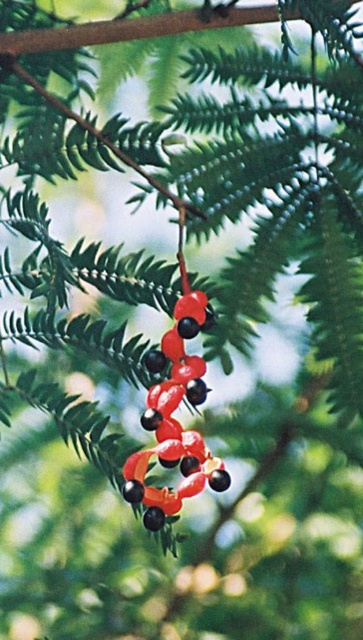
Image resolution: width=363 pixels, height=640 pixels. Describe the element at coordinates (174, 420) in the screenshot. I see `glossy red berries at center` at that location.

Does point (158, 355) lie in front of point (139, 20)?

Yes, point (158, 355) is closer to viewer.

Is point (177, 460) positioned before point (95, 20)?

Yes.

Image resolution: width=363 pixels, height=640 pixels. I want to click on glossy red berries at center, so click(174, 420).